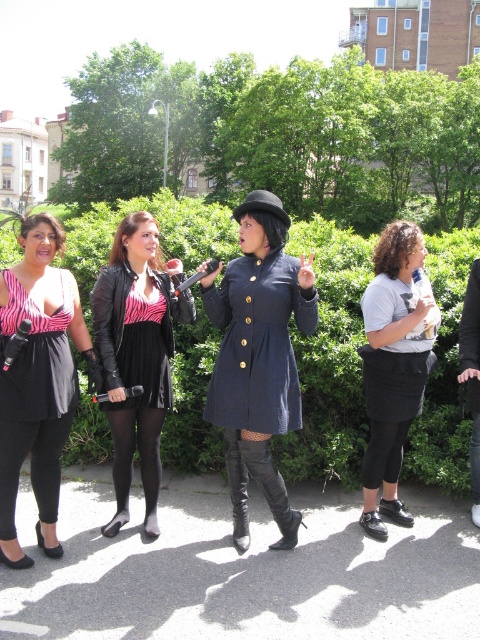
Question: Is the position of green leafy hedge at center more distant than that of matte black dress at left?

Choices:
 (A) no
 (B) yes

Answer: (B)

Question: Where is matte black dress at left located in relation to black leather jacket at left in the image?

Choices:
 (A) above
 (B) below

Answer: (B)

Question: Which object is positioned closest to the leather boots at center?

Choices:
 (A) green leafy hedge at center
 (B) leather jacket at center
 (C) black leather boot at center

Answer: (C)

Question: Observing the image, what is the correct spatial positioning of pink zebra print dress at left in reference to black leather boot at center?

Choices:
 (A) below
 (B) above

Answer: (B)

Question: Based on their relative distances, which object is farther from the white cotton shirt at center?

Choices:
 (A) matte navy coat at center
 (B) black leather jacket at left
 (C) pink zebra print dress at left

Answer: (C)

Question: Which of these objects is positioned farthest from the black leather boot at center?

Choices:
 (A) white cotton shirt at center
 (B) green leafy hedge at center

Answer: (B)